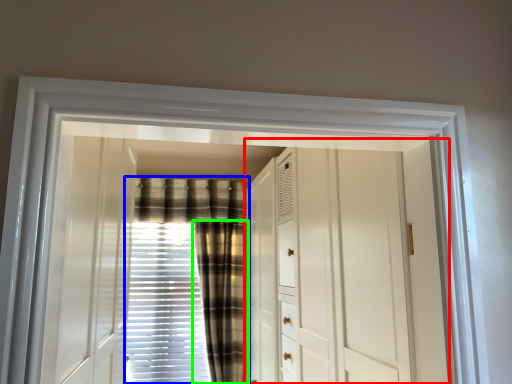
Question: Which object is positioned closest to dresser (highlighted by a red box)? Select from curtain (highlighted by a blue box) and curtain (highlighted by a green box).

Choices:
 (A) curtain
 (B) curtain

Answer: (B)